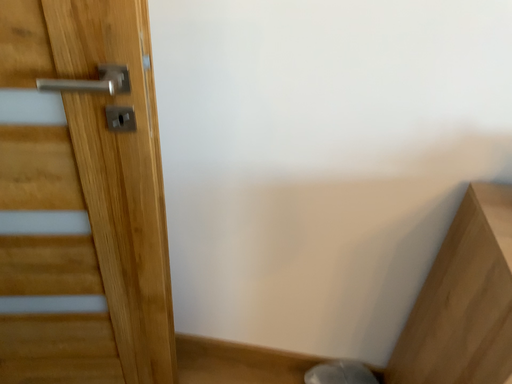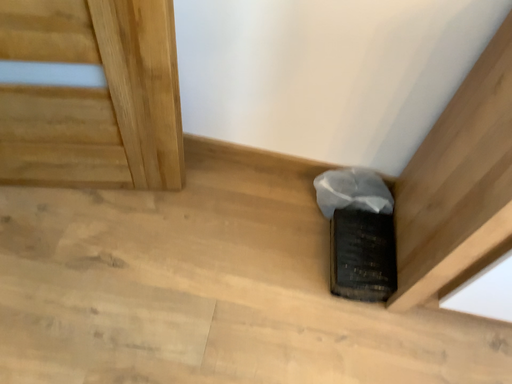
Question: Which way did the camera rotate in the video?

Choices:
 (A) rotated downward
 (B) rotated upward

Answer: (A)